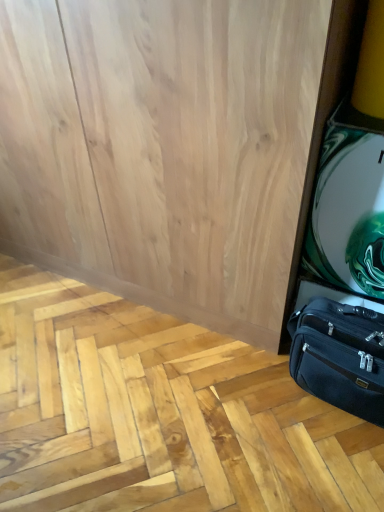
Image resolution: width=384 pixels, height=512 pixels. Describe the element at coordinates (340, 356) in the screenshot. I see `black fabric suitcase at lower right` at that location.

Locate an element on the screen. Image resolution: width=384 pixels, height=512 pixels. black fabric suitcase at lower right is located at coordinates (340, 356).

Identify the location of black fabric suitcase at lower right. The width and height of the screenshot is (384, 512). (340, 356).